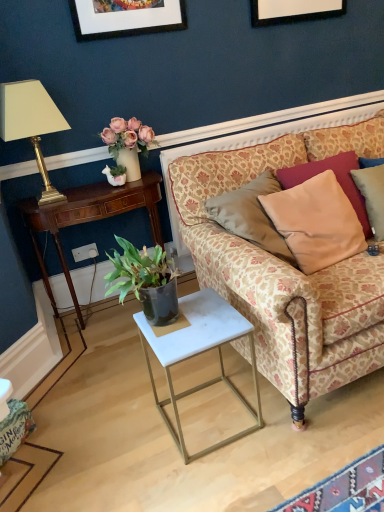
Question: Can you confirm if white marble table at lower center is wider than white fabric lampshade at left?

Choices:
 (A) no
 (B) yes

Answer: (B)

Question: Would you say white fabric lampshade at left is part of white marble table at lower center's contents?

Choices:
 (A) no
 (B) yes

Answer: (A)

Question: Is white marble table at lower center looking in the opposite direction of white fabric lampshade at left?

Choices:
 (A) no
 (B) yes

Answer: (A)

Question: From the image's perspective, is white marble table at lower center on top of white fabric lampshade at left?

Choices:
 (A) no
 (B) yes

Answer: (A)

Question: Considering the relative positions of white marble table at lower center and white fabric lampshade at left in the image provided, is white marble table at lower center to the left of white fabric lampshade at left from the viewer's perspective?

Choices:
 (A) yes
 (B) no

Answer: (B)

Question: From a real-world perspective, is white marble table at lower center on white fabric lampshade at left?

Choices:
 (A) yes
 (B) no

Answer: (B)

Question: Does mahogany wood desk at left have a larger size compared to white marble table at lower center?

Choices:
 (A) no
 (B) yes

Answer: (B)

Question: Could you tell me if mahogany wood desk at left is turned towards white marble table at lower center?

Choices:
 (A) no
 (B) yes

Answer: (B)

Question: Can you confirm if mahogany wood desk at left is smaller than white marble table at lower center?

Choices:
 (A) yes
 (B) no

Answer: (B)

Question: Is mahogany wood desk at left oriented away from white marble table at lower center?

Choices:
 (A) no
 (B) yes

Answer: (A)

Question: Would you consider mahogany wood desk at left to be distant from white marble table at lower center?

Choices:
 (A) no
 (B) yes

Answer: (A)

Question: Can you confirm if mahogany wood desk at left is shorter than white marble table at lower center?

Choices:
 (A) yes
 (B) no

Answer: (B)

Question: Considering the relative sizes of white marble table at lower center and beige fabric pillow at right, the second pillow positioned from the front, in the image provided, is white marble table at lower center wider than beige fabric pillow at right, the second pillow positioned from the front,?

Choices:
 (A) yes
 (B) no

Answer: (A)